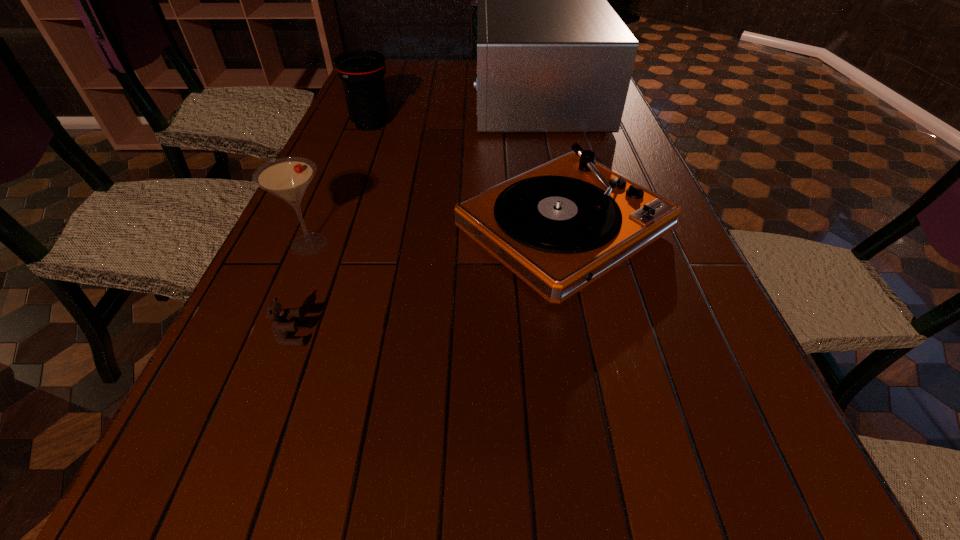
At what (x,y) coordinates should I click in order to perform the action: click on free space at the far edge. Please return your answer as a coordinate pair (x, y). The height and width of the screenshot is (540, 960). Looking at the image, I should click on (468, 61).

In the image, there is a desktop. Find the location of `free space at the left edge`. free space at the left edge is located at coordinates (318, 293).

The image size is (960, 540). I want to click on vacant space at the right edge of the desktop, so click(x=663, y=284).

The height and width of the screenshot is (540, 960). I want to click on empty space that is in between the teddy bear and the record player, so click(429, 282).

Where is `free spot between the microwave oven and the teddy bear`? The image size is (960, 540). free spot between the microwave oven and the teddy bear is located at coordinates (417, 220).

Image resolution: width=960 pixels, height=540 pixels. What are the coordinates of `empty space that is in between the shortest object and the telephoto lens` in the screenshot? It's located at (332, 230).

At what (x,y) coordinates should I click in order to perform the action: click on free spot between the microwave oven and the martini. Please return your answer as a coordinate pair (x, y). Looking at the image, I should click on (424, 174).

Identify the location of free point between the tallest object and the martini. (424, 174).

At what (x,y) coordinates should I click in order to perform the action: click on free point between the nearest object and the record player. Please return your answer as a coordinate pair (x, y). Image resolution: width=960 pixels, height=540 pixels. Looking at the image, I should click on (429, 282).

You are a GUI agent. You are given a task and a screenshot of the screen. Output one action in this format:
    pyautogui.click(x=<x>, y=<y>)
    Task: Click on the empty space that is in between the telephoto lens and the tallest object
    
    Given the screenshot: What is the action you would take?
    pyautogui.click(x=455, y=114)